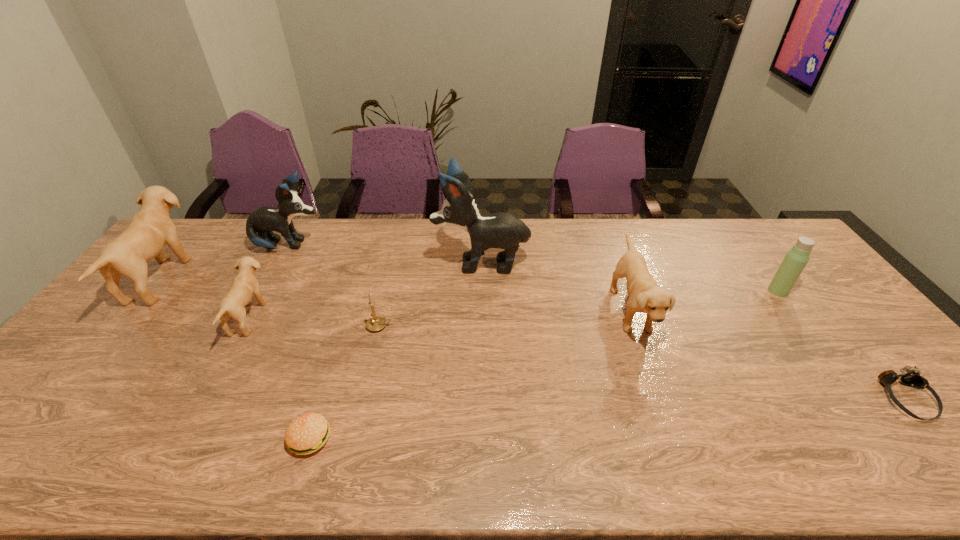
The width and height of the screenshot is (960, 540). I want to click on blank space located on the front-facing side of the left black puppy, so click(x=394, y=246).

Locate an element on the screen. The height and width of the screenshot is (540, 960). vacant space located 0.080m on the left side of the leftmost beige puppy is located at coordinates (204, 279).

The height and width of the screenshot is (540, 960). In order to click on free spot located 0.330m on the left side of the rightmost beige puppy in this screenshot , I will do `click(502, 310)`.

Find the location of a particular element. The height and width of the screenshot is (540, 960). free space located on the left side of the rightmost beige puppy is located at coordinates (506, 310).

Where is `free region located on the left side of the rightmost beige puppy`? The width and height of the screenshot is (960, 540). free region located on the left side of the rightmost beige puppy is located at coordinates (546, 310).

Locate an element on the screen. free space located 0.100m on the back of the light thermos bottle is located at coordinates (758, 265).

You are a GUI agent. You are given a task and a screenshot of the screen. Output one action in this format:
    pyautogui.click(x=<x>, y=<y>)
    Task: Click on the free space located 0.070m on the left side of the smallest beige puppy
    The height and width of the screenshot is (540, 960).
    Given the screenshot: What is the action you would take?
    pyautogui.click(x=285, y=318)

Where is `vacant space positioned on the handle side of the fifth object from left to right`? This screenshot has width=960, height=540. vacant space positioned on the handle side of the fifth object from left to right is located at coordinates (448, 326).

The image size is (960, 540). What are the coordinates of `free space located through the lenses of the rightmost object` in the screenshot? It's located at (950, 452).

At what (x,y) coordinates should I click in order to perform the action: click on free spot located 0.140m on the right of the brown patty. Please return your answer as a coordinate pair (x, y). Looking at the image, I should click on (393, 438).